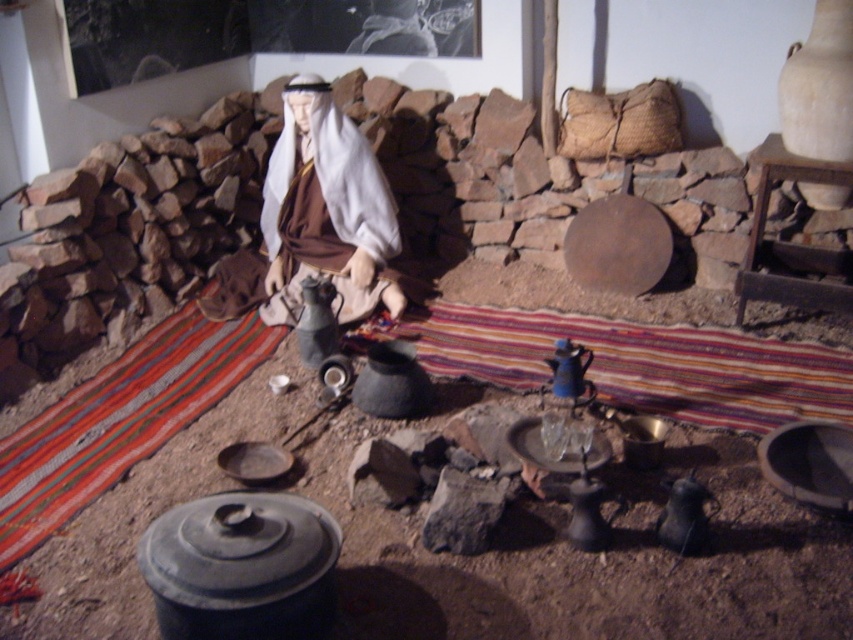
Is matte black pot at center to the right of white matte figure at center from the viewer's perspective?

Correct, you'll find matte black pot at center to the right of white matte figure at center.

Is matte black pot at center positioned before white matte figure at center?

That is True.

Between point (296, 628) and point (392, 257), which one is positioned behind?

The point (392, 257) is behind.

Where is `matte black pot at center`? Image resolution: width=853 pixels, height=640 pixels. matte black pot at center is located at coordinates (241, 566).

Does white matte figure at center come behind blue glazed earthenware teapot at center?

Yes, white matte figure at center is further from the viewer.

Locate an element on the screen. The height and width of the screenshot is (640, 853). white matte figure at center is located at coordinates (326, 209).

Does point (339, 273) come behind point (573, 378)?

Yes, it is.

I want to click on white matte figure at center, so click(x=326, y=209).

Is point (167, 564) farther from camera compared to point (552, 380)?

No.

This screenshot has width=853, height=640. In order to click on matte black pot at center in this screenshot , I will do `click(241, 566)`.

Locate an element on the screen. This screenshot has height=640, width=853. matte black pot at center is located at coordinates (241, 566).